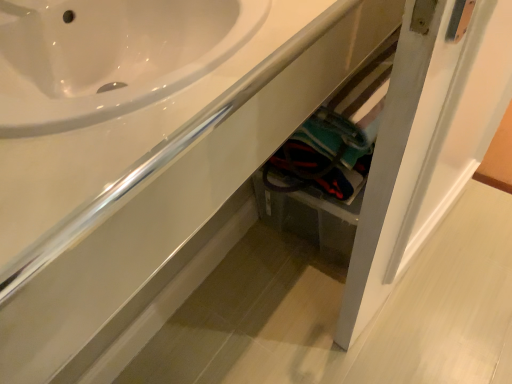
Question: Does white glossy door at lower right have a smaller size compared to white glossy sink at upper left?

Choices:
 (A) yes
 (B) no

Answer: (B)

Question: Does white glossy door at lower right come behind white glossy sink at upper left?

Choices:
 (A) yes
 (B) no

Answer: (A)

Question: From the image's perspective, is white glossy door at lower right beneath white glossy sink at upper left?

Choices:
 (A) no
 (B) yes

Answer: (B)

Question: Is white glossy door at lower right at the left side of white glossy sink at upper left?

Choices:
 (A) no
 (B) yes

Answer: (A)

Question: Is white glossy door at lower right positioned beyond the bounds of white glossy sink at upper left?

Choices:
 (A) yes
 (B) no

Answer: (A)

Question: Is white glossy door at lower right positioned in front of white glossy sink at upper left?

Choices:
 (A) yes
 (B) no

Answer: (B)

Question: Is white glossy sink at upper left far from white glossy door at lower right?

Choices:
 (A) no
 (B) yes

Answer: (A)

Question: Would you say white glossy sink at upper left is outside white glossy door at lower right?

Choices:
 (A) yes
 (B) no

Answer: (A)

Question: Is white glossy sink at upper left thinner than white glossy door at lower right?

Choices:
 (A) yes
 (B) no

Answer: (B)

Question: Is the depth of white glossy sink at upper left less than that of white glossy door at lower right?

Choices:
 (A) no
 (B) yes

Answer: (B)

Question: Can you confirm if white glossy sink at upper left is taller than white glossy door at lower right?

Choices:
 (A) no
 (B) yes

Answer: (A)

Question: Does white glossy sink at upper left have a larger size compared to white glossy door at lower right?

Choices:
 (A) yes
 (B) no

Answer: (B)

Question: Relative to white glossy door at lower right, is white glossy sink at upper left in front or behind?

Choices:
 (A) behind
 (B) front

Answer: (B)